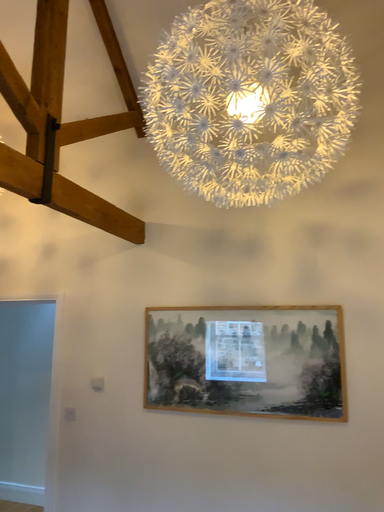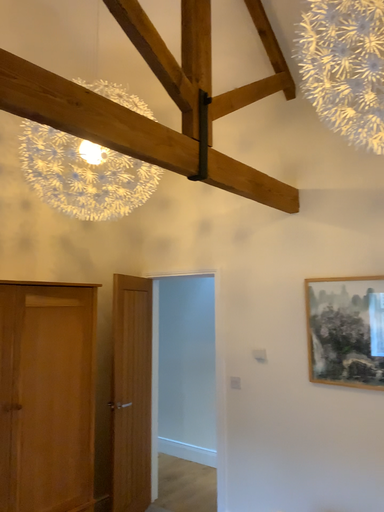
Question: Which way did the camera rotate in the video?

Choices:
 (A) rotated left
 (B) rotated right

Answer: (A)